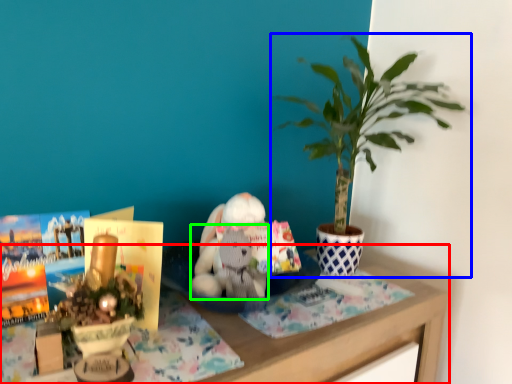
Question: Considering the real-world distances, which object is farthest from table (highlighted by a red box)? houseplant (highlighted by a blue box) or animal (highlighted by a green box)?

Choices:
 (A) houseplant
 (B) animal

Answer: (A)